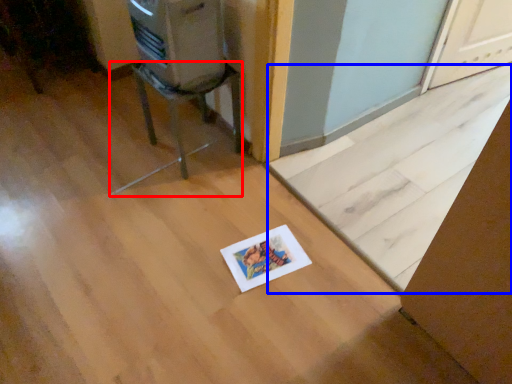
Question: Which object appears closest to the camera in this image, furniture (highlighted by a red box) or doormat (highlighted by a blue box)?

Choices:
 (A) furniture
 (B) doormat

Answer: (B)